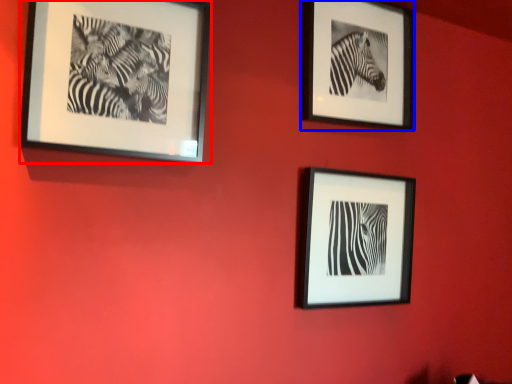
Question: Which object is further to the camera taking this photo, picture frame (highlighted by a red box) or picture frame (highlighted by a blue box)?

Choices:
 (A) picture frame
 (B) picture frame

Answer: (B)